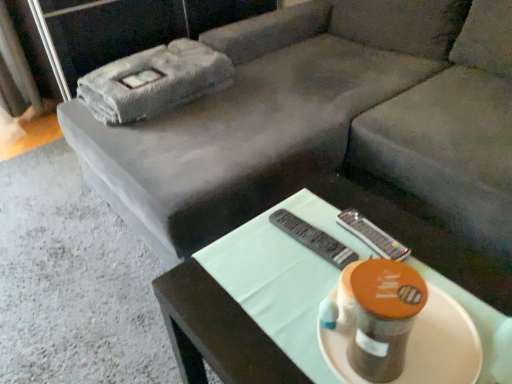
At what (x,y) coordinates should I click in order to perform the action: click on vacant space situated on the left part of matte white platter at center. Please return your answer as a coordinate pair (x, y). Looking at the image, I should click on (260, 336).